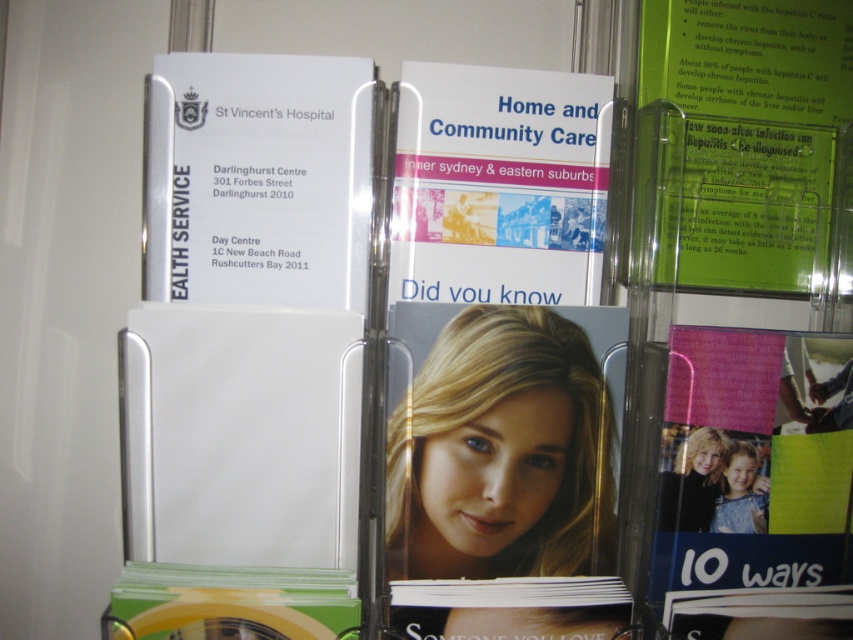
You are organizing a health fair and need to display the pink glossy magazine at lower right and the white paper at center. Which one requires a thicker display stand?

The white paper at center requires a thicker display stand because it is thicker than the pink glossy magazine at lower right.

You are a visitor at the wall mounted brochure holder and want to take both the white paper at upper left and green plastic card at upper right. Which one is easier to reach without moving your position?

The white paper at upper left is closer to the viewer, so it is easier to reach without moving your position.